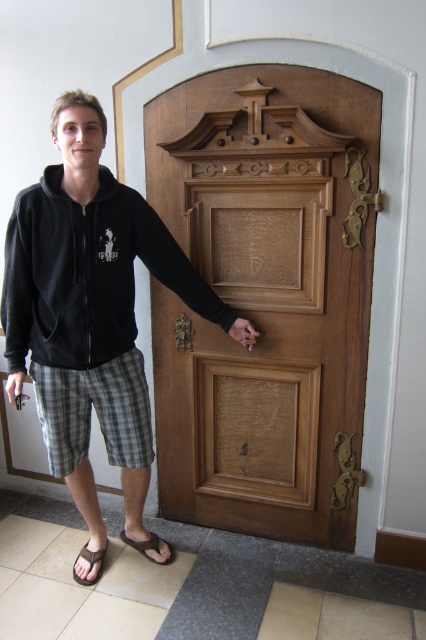
Can you confirm if wooden carved door at center is taller than black fleece sweatshirt at left?

Yes, wooden carved door at center is taller than black fleece sweatshirt at left.

Find the location of a particular element. The height and width of the screenshot is (640, 426). wooden carved door at center is located at coordinates (265, 298).

Between point (365, 362) and point (94, 346), which one is positioned behind?

The point (365, 362) is more distant.

Identify the location of wooden carved door at center. click(265, 298).

Who is more distant from viewer, (135, 545) or (89, 557)?

Point (135, 545)

Is brown leather sandal at lower left bigger than black rubber sandal at lower left?

Yes.

Find the location of a particular element. The image size is (426, 640). brown leather sandal at lower left is located at coordinates (147, 547).

Who is more distant from viewer, (x=34, y=337) or (x=91, y=566)?

Point (x=91, y=566)

What do you see at coordinates (91, 310) in the screenshot? I see `black cotton hoodie at center` at bounding box center [91, 310].

You are a GUI agent. You are given a task and a screenshot of the screen. Output one action in this format:
    pyautogui.click(x=<x>, y=<y>)
    Task: Click on the black cotton hoodie at center
    This screenshot has width=426, height=640.
    Given the screenshot: What is the action you would take?
    pyautogui.click(x=91, y=310)